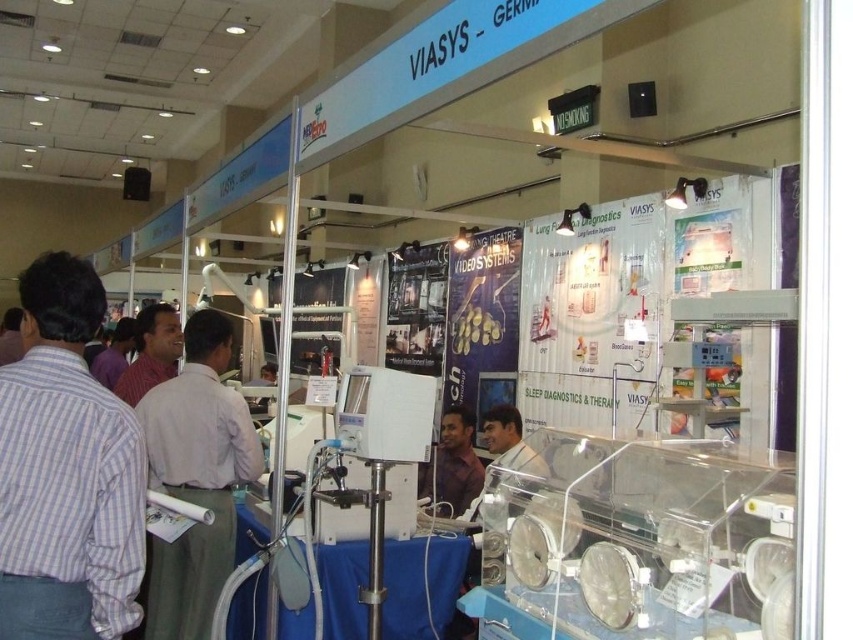
Measure the distance between light brown shirt at center and camera.

They are 9.24 feet apart.

This screenshot has width=853, height=640. What do you see at coordinates (196, 477) in the screenshot? I see `light brown shirt at center` at bounding box center [196, 477].

Which is behind, point (160, 576) or point (126, 387)?

Point (126, 387)

The height and width of the screenshot is (640, 853). I want to click on light brown shirt at center, so [x=196, y=477].

Measure the distance from striped cotton shirt at left to matte pink shirt at left.

The distance of striped cotton shirt at left from matte pink shirt at left is 2.32 meters.

Is striped cotton shirt at left above matte pink shirt at left?

Indeed, striped cotton shirt at left is positioned over matte pink shirt at left.

Image resolution: width=853 pixels, height=640 pixels. I want to click on striped cotton shirt at left, so click(x=67, y=472).

Does light brown shirt at center have a lesser width compared to matte brown shirt at center?

Incorrect, light brown shirt at center's width is not less than matte brown shirt at center's.

Based on the photo, between light brown shirt at center and matte brown shirt at center, which one is positioned higher?

light brown shirt at center

Identify the location of light brown shirt at center. (196, 477).

This screenshot has height=640, width=853. I want to click on light brown shirt at center, so click(x=196, y=477).